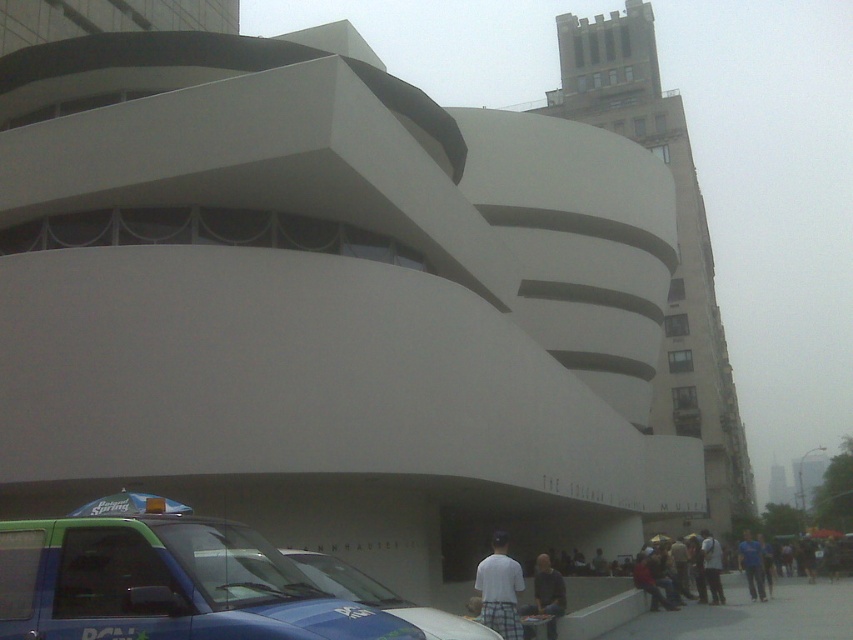
You are a photographer standing in front of the Solomon R. Guggenheim Museum. You notice a blue glossy car at lower left and white plaid shorts at lower center in your viewfinder. Which object is located more to the left side of the scene?

The blue glossy car at lower left is positioned on the left side of white plaid shorts at lower center, so the blue glossy car at lower left is more to the left.

You are a photographer standing in front of the Solomon R. Guggenheim Museum. You want to take a photo that includes both the blue glossy car at lower left and the white cotton shirt at center. Which object should you focus on first to ensure both are in sharp focus?

You should focus on the white cotton shirt at center first because the blue glossy car at lower left is closer to the viewer, so adjusting focus from near to far will help both be in sharp focus.

You are a photographer planning to take a photo of the Solomon R. Guggenheim Museum. You want to ensure both the blue glossy car at lower left and the white plaid shorts at lower center are visible in the frame. Which object should you position closer to the camera to make sure both are in focus?

The blue glossy car at lower left is larger in size compared to the white plaid shorts at lower center. To ensure both are in focus, position the blue glossy car at lower left closer to the camera since its larger size allows it to be captured clearly even when nearer.